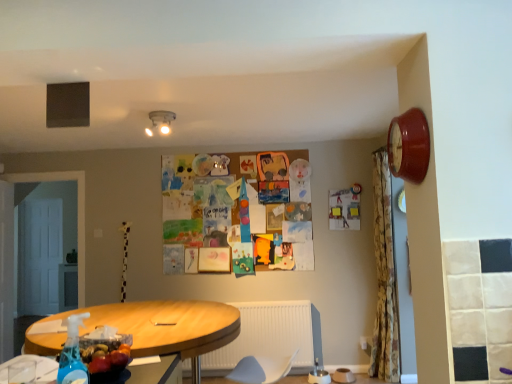
The width and height of the screenshot is (512, 384). I want to click on vacant point above matte white ceiling light at upper center (from a real-world perspective), so click(157, 114).